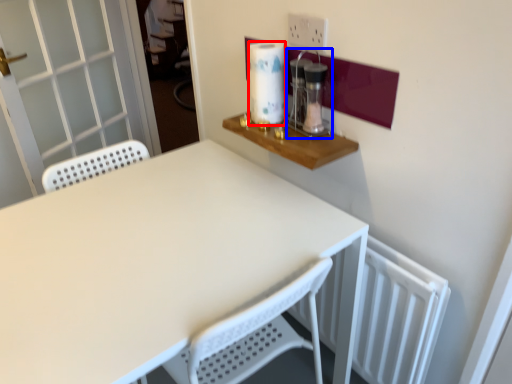
Question: Which object appears farthest to the camera in this image, paper towel (highlighted by a red box) or coffee machine (highlighted by a blue box)?

Choices:
 (A) paper towel
 (B) coffee machine

Answer: (A)